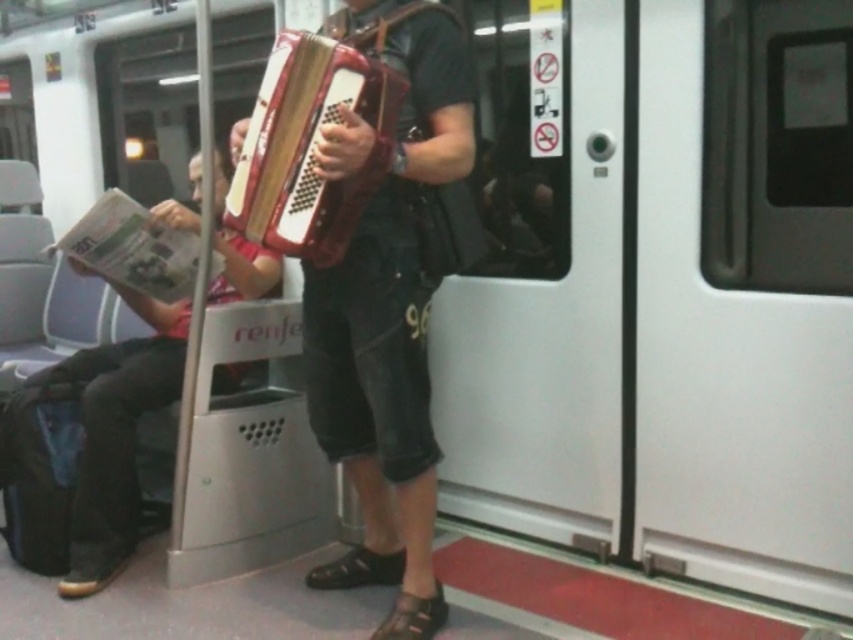
Question: Which of the following is the farthest from the observer?

Choices:
 (A) matte red accordion at center
 (B) wooden accordion at center
 (C) wooden textured accordion at center

Answer: (A)

Question: Does wooden accordion at center come in front of wooden textured accordion at center?

Choices:
 (A) yes
 (B) no

Answer: (A)

Question: Is wooden accordion at center positioned in front of matte red accordion at center?

Choices:
 (A) no
 (B) yes

Answer: (B)

Question: Which point is closer to the camera?

Choices:
 (A) wooden accordion at center
 (B) wooden textured accordion at center
 (C) matte red accordion at center

Answer: (A)

Question: Does wooden accordion at center have a smaller size compared to matte red accordion at center?

Choices:
 (A) no
 (B) yes

Answer: (B)

Question: Which point appears farthest from the camera in this image?

Choices:
 (A) (74, 566)
 (B) (395, 481)

Answer: (A)